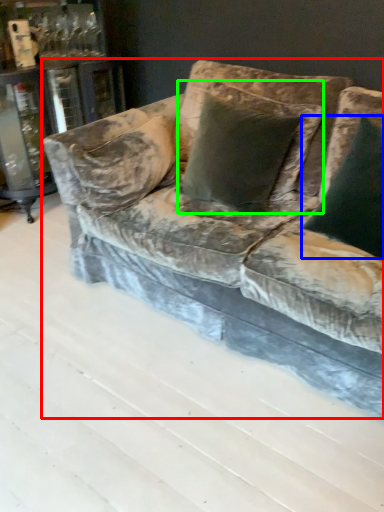
Question: Considering the real-world distances, which object is farthest from studio couch (highlighted by a red box)? pillow (highlighted by a blue box) or pillow (highlighted by a green box)?

Choices:
 (A) pillow
 (B) pillow

Answer: (A)